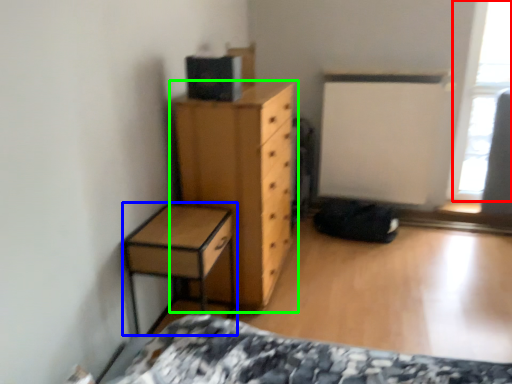
Question: Estimate the real-world distances between objects in this image. Which object is closer to window screen (highlighted by a red box), nightstand (highlighted by a blue box) or chest of drawers (highlighted by a green box)?

Choices:
 (A) nightstand
 (B) chest of drawers

Answer: (B)